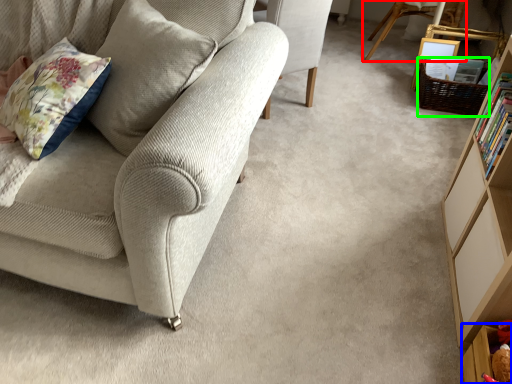
Question: Considering the real-world distances, which object is closest to chair (highlighted by a red box)? shelf (highlighted by a blue box) or basket (highlighted by a green box).

Choices:
 (A) shelf
 (B) basket

Answer: (B)